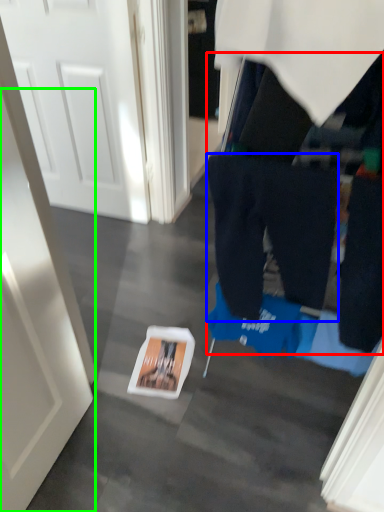
Question: Estimate the real-world distances between objects in this image. Which object is farther from tight (highlighted by a red box), trousers (highlighted by a blue box) or door (highlighted by a green box)?

Choices:
 (A) trousers
 (B) door

Answer: (B)